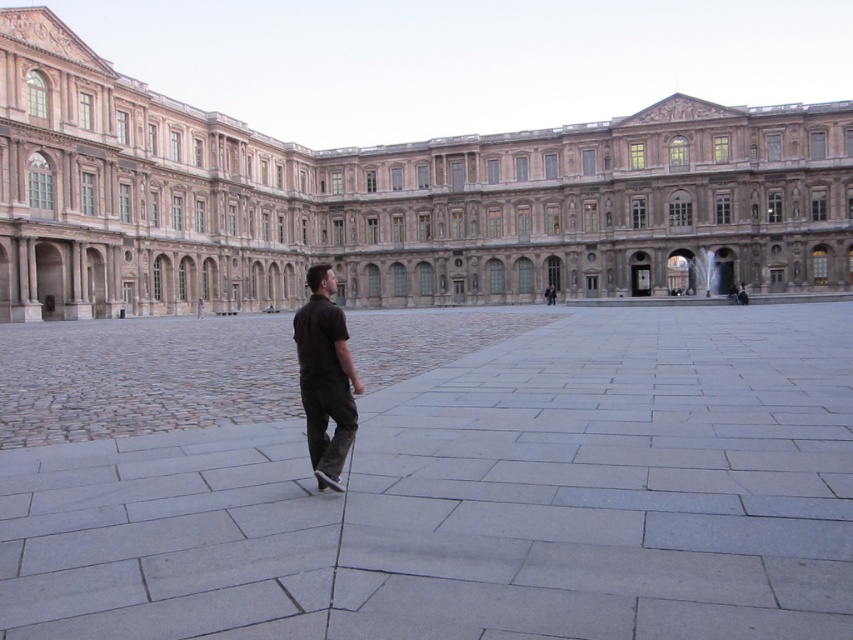
Question: Is gray stone courtyard at center above dark brown shirt at center?

Choices:
 (A) yes
 (B) no

Answer: (B)

Question: Among these points, which one is nearest to the camera?

Choices:
 (A) (753, 128)
 (B) (746, 531)

Answer: (B)

Question: Can you confirm if beige stone palace at center is positioned above dark brown shirt at center?

Choices:
 (A) yes
 (B) no

Answer: (A)

Question: Among these points, which one is farthest from the camera?

Choices:
 (A) (471, 136)
 (B) (824, 432)

Answer: (A)

Question: Does gray stone courtyard at center appear under dark brown shirt at center?

Choices:
 (A) yes
 (B) no

Answer: (A)

Question: Which object appears farthest from the camera in this image?

Choices:
 (A) gray stone courtyard at center
 (B) dark brown shirt at center
 (C) beige stone palace at center

Answer: (C)